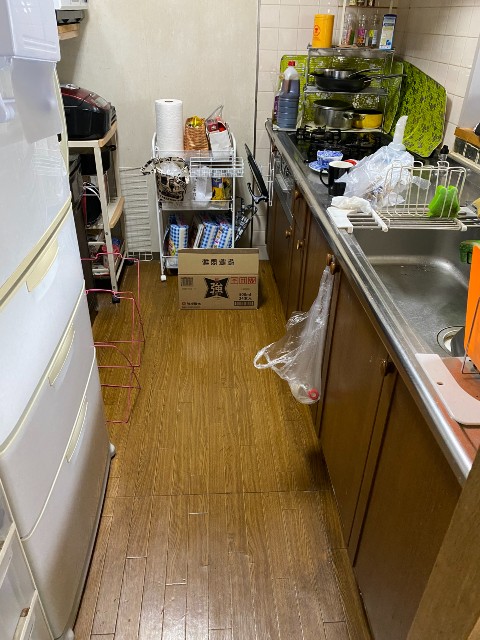
Identify the location of sink. (423, 308).